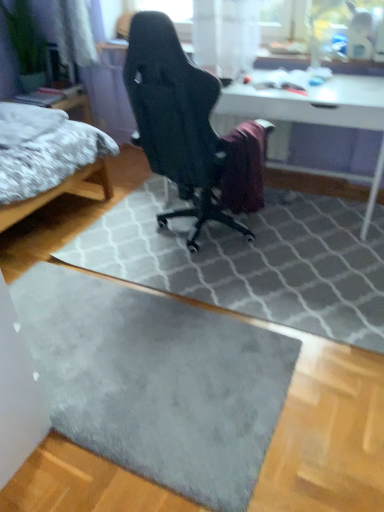
Where is `free region on the left part of black mesh chair at center`? Image resolution: width=384 pixels, height=512 pixels. free region on the left part of black mesh chair at center is located at coordinates tap(113, 234).